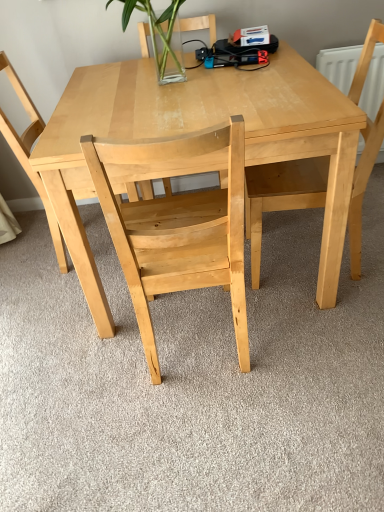
At what (x,y) coordinates should I click in order to perform the action: click on vacant area that lies to the right of natural wood chair at center, positioned as the 2th chair in right-to-left order. Please return your answer as a coordinate pair (x, y). This screenshot has height=512, width=384. Looking at the image, I should click on (317, 351).